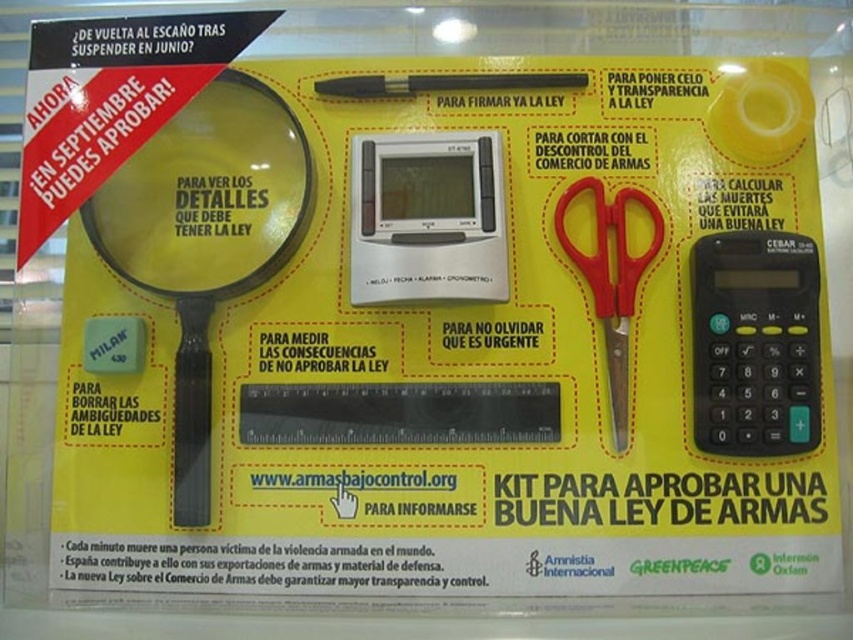
You are designing a promotional poster and need to place a transparent plastic magnifying glass at upper left and a black plastic pen at center. If the magnifying glass is narrower than the pen, where should you position the magnifying glass to ensure it doesn

The transparent plastic magnifying glass at upper left should be placed to the left of the black plastic pen at center since it is narrower, allowing the pen to occupy more space in the center for emphasis.

What object is located at the coordinates point (207, 195) on the poster?

The transparent plastic magnifying glass at upper left is located at point (207, 195).